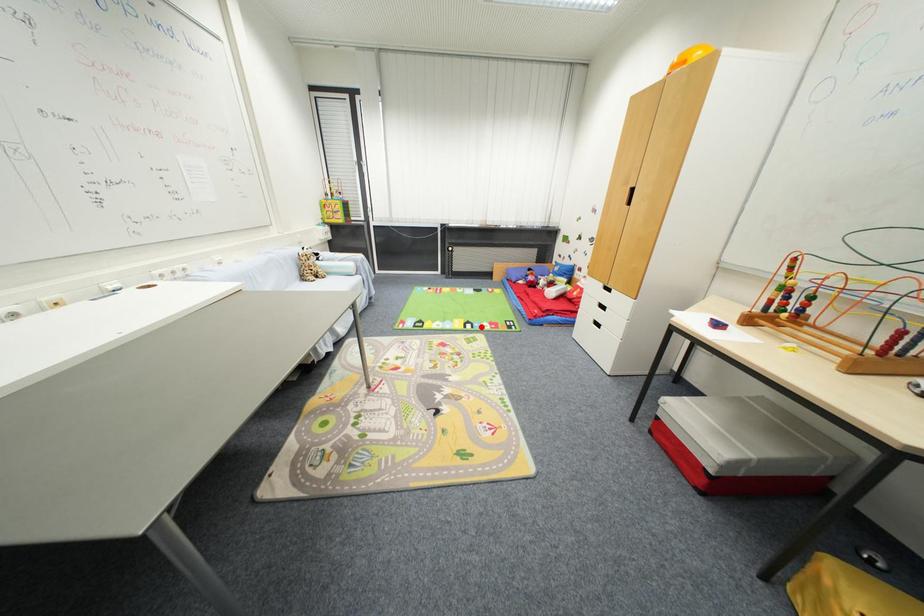
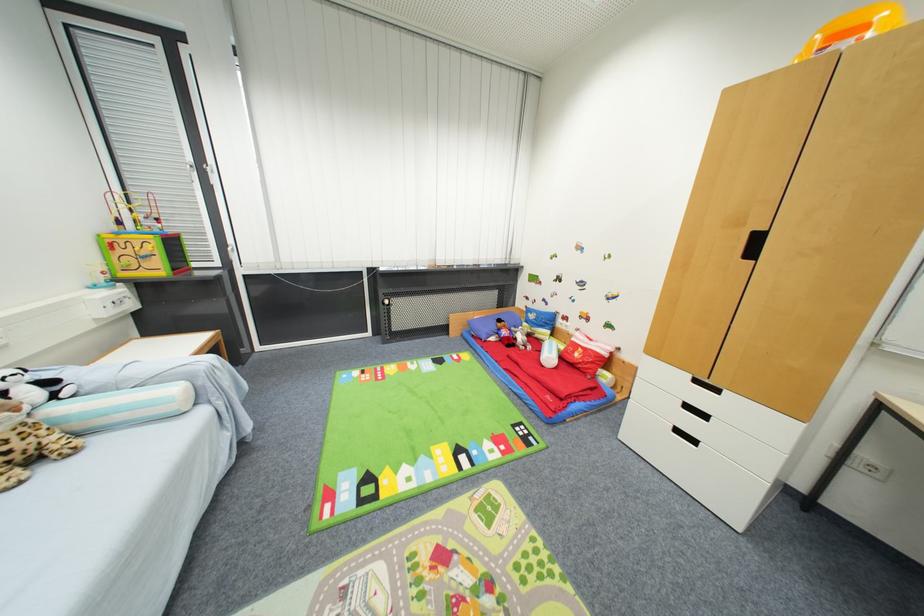
The point at the highlighted location is marked in the first image. Where is the corresponding point in the second image?

(479, 455)